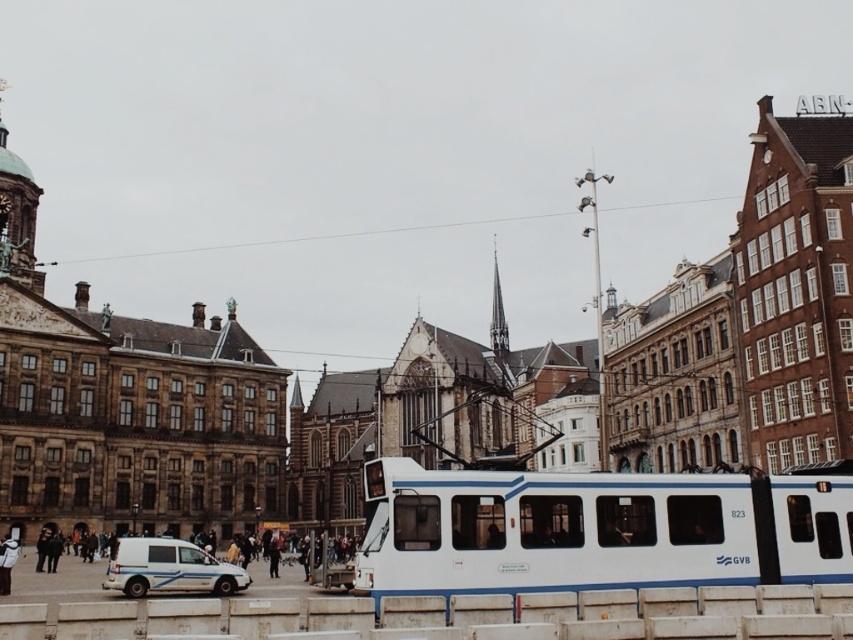
Question: Is white glossy passenger train at center in front of white matte van at lower left?

Choices:
 (A) no
 (B) yes

Answer: (B)

Question: Can you confirm if white glossy passenger train at center is wider than white matte van at lower left?

Choices:
 (A) no
 (B) yes

Answer: (B)

Question: Which of the following is the closest to the observer?

Choices:
 (A) (587, 547)
 (B) (131, 541)

Answer: (A)

Question: Is white glossy passenger train at center wider than white matte van at lower left?

Choices:
 (A) no
 (B) yes

Answer: (B)